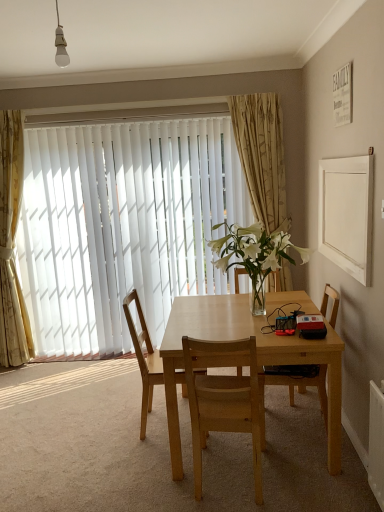
Where is `vacant space to the left of light wood chair at center, the first chair when ordered from left to right`? The width and height of the screenshot is (384, 512). vacant space to the left of light wood chair at center, the first chair when ordered from left to right is located at coordinates (113, 424).